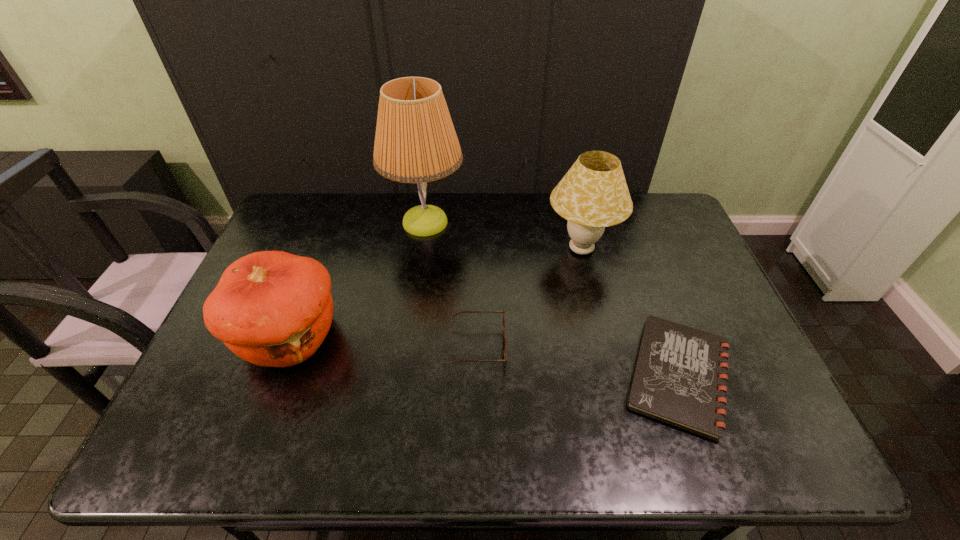
Identify the location of lamp. (415, 142).

Locate an element on the screen. This screenshot has width=960, height=540. the second tallest object is located at coordinates (593, 194).

Locate an element on the screen. the leftmost object is located at coordinates (271, 308).

Locate an element on the screen. This screenshot has width=960, height=540. the third shortest object is located at coordinates (271, 308).

The width and height of the screenshot is (960, 540). I want to click on the second shortest object, so click(x=503, y=336).

The width and height of the screenshot is (960, 540). In order to click on notebook in this screenshot , I will do `click(680, 378)`.

At what (x,y) coordinates should I click in order to perform the action: click on vacant space located 0.230m on the side of the tallest object near the pull switch. Please return your answer as a coordinate pair (x, y). The image size is (960, 540). Looking at the image, I should click on (532, 222).

In order to click on free space located 0.300m on the left of the lampshade in this screenshot , I will do `click(450, 249)`.

Find the location of a particular element. vacant position located 0.360m on the right of the pumpkin is located at coordinates (479, 337).

The width and height of the screenshot is (960, 540). I want to click on vacant space located 0.200m at the front view of the spectacles, so [582, 347].